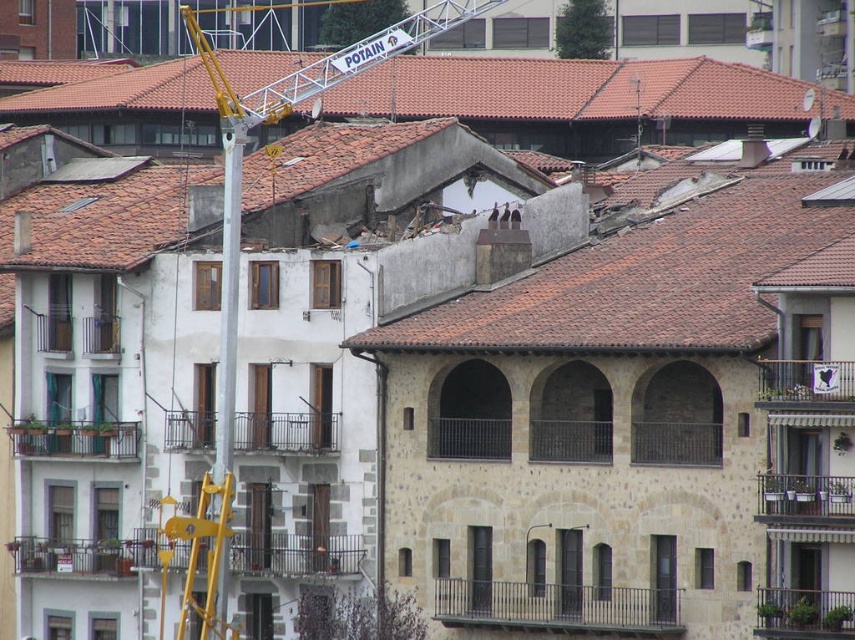
You are standing in the urban scene and want to take a photo of the brown tile roof at upper center. Based on its position, would you aim your camera more towards the upper or lower part of the frame?

The brown tile roof at upper center is located at point (568, 90), which means it is positioned higher up in the frame. Therefore, you should aim your camera more towards the upper part of the frame to capture it.

You are standing at point (196, 67) and want to walk to the nearest building. The nearest building is 147.17 meters away. Can you walk there in 3 minutes if you walk at 1.5 m per second?

The distance to the nearest building is 147.17 meters. At a walking speed of 1.5 m per second, it would take approximately 98 seconds, which is about 1.63 minutes. Therefore, yes, you can reach the nearest building in under 3 minutes.